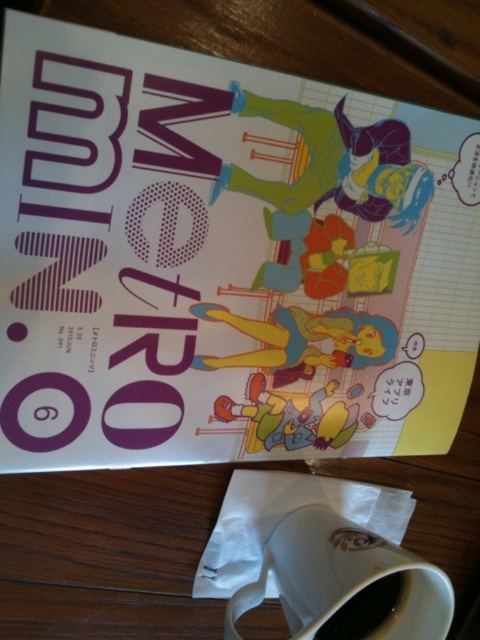
Question: Which object is farther from the camera taking this photo?

Choices:
 (A) matte purple comic book at center
 (B) white ceramic mug at lower center

Answer: (B)

Question: Does matte purple comic book at center appear over white ceramic mug at lower center?

Choices:
 (A) no
 (B) yes

Answer: (B)

Question: Is matte purple comic book at center to the right of white ceramic mug at lower center from the viewer's perspective?

Choices:
 (A) no
 (B) yes

Answer: (A)

Question: Does matte purple comic book at center have a larger size compared to white ceramic mug at lower center?

Choices:
 (A) no
 (B) yes

Answer: (B)

Question: Among these points, which one is nearest to the camera?

Choices:
 (A) (425, 563)
 (B) (240, 323)

Answer: (B)